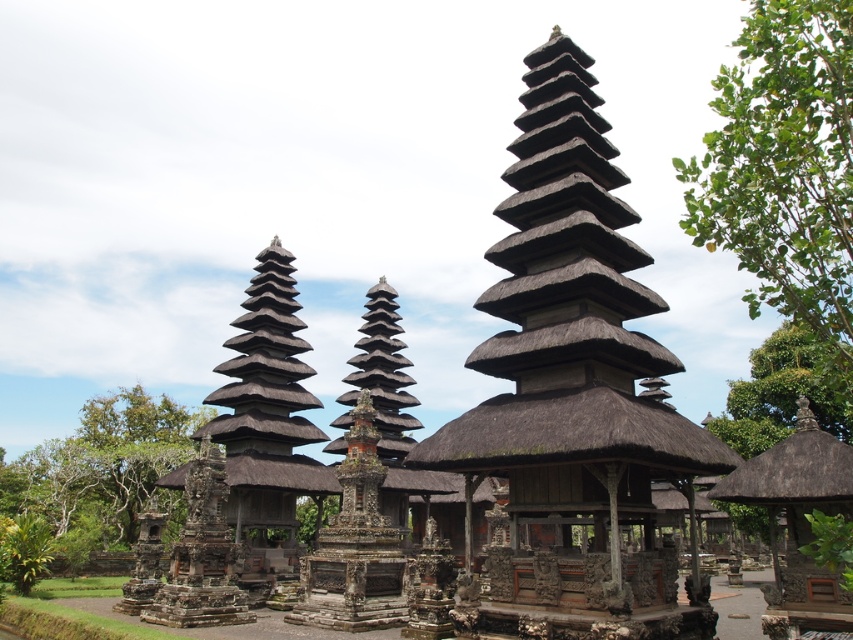
You are standing in the temple complex and want to take a photo of the dark brown thatched roof tower at center and the green leafy tree at lower left. Which object should you focus on first to ensure both are in the frame?

The dark brown thatched roof tower at center is above the green leafy tree at lower left, so you should focus on the dark brown thatched roof tower at center first to ensure both are in the frame.

In the scene shown: You are standing in the temple complex and notice a point marked at coordinates (573,392). Which object in the scene corresponds to this point?

The point at coordinates (573,392) corresponds to the dark brown thatched roof tower at center.

You are standing at the entrance of the temple complex and want to reach the point marked at coordinates point (659, 563). If your walking speed is 1.5 meters per second, how many seconds will it take you to reach that point?

The distance between you and point (659, 563) is 24.18 meters. At a walking speed of 1.5 meters per second, it will take approximately 16.12 seconds to reach the point.